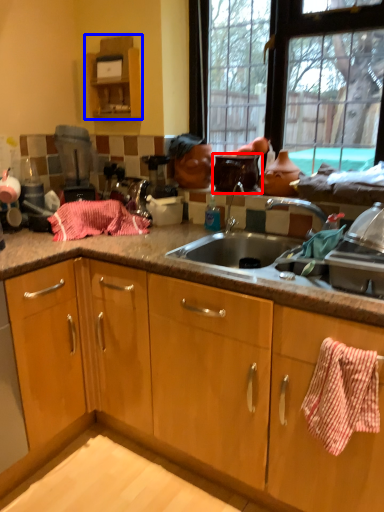
Question: Which object appears closest to the camera in this image, appliance (highlighted by a red box) or cabinetry (highlighted by a blue box)?

Choices:
 (A) appliance
 (B) cabinetry

Answer: (A)